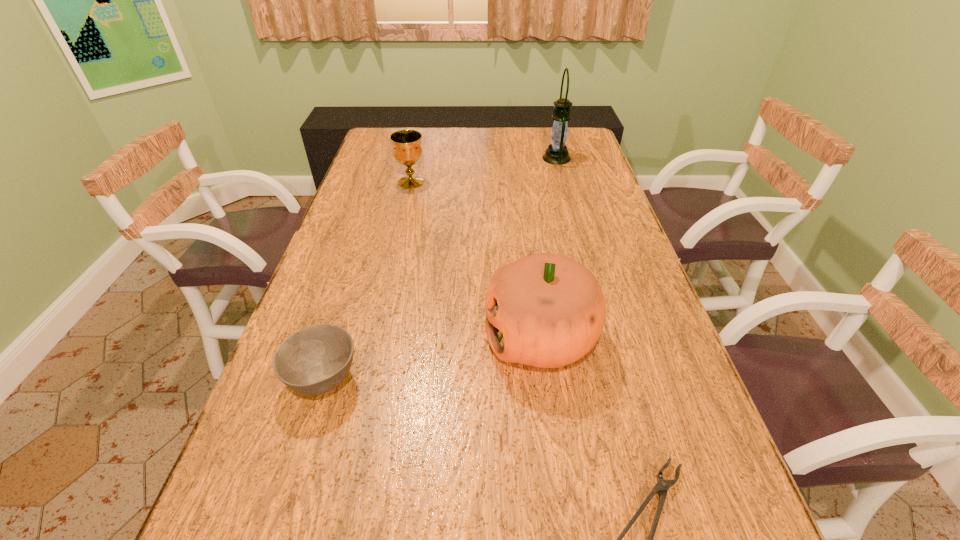
The width and height of the screenshot is (960, 540). Find the location of `vacant region located on the face of the pumpkin`. vacant region located on the face of the pumpkin is located at coordinates (379, 337).

Locate an element on the screen. The height and width of the screenshot is (540, 960). free location located 0.220m on the face of the pumpkin is located at coordinates (388, 337).

At what (x,y) coordinates should I click in order to perform the action: click on free space located on the left of the fourth nearest object. Please return your answer as a coordinate pair (x, y). This screenshot has height=540, width=960. Looking at the image, I should click on (364, 182).

Identify the location of vacant space located 0.210m on the back of the second shortest object. (353, 286).

The height and width of the screenshot is (540, 960). I want to click on object that is at the far edge, so click(556, 153).

I want to click on chalice that is positioned at the left edge, so click(x=407, y=150).

The width and height of the screenshot is (960, 540). I want to click on bowl that is at the left edge, so click(x=312, y=361).

Locate an element on the screen. object present at the right edge is located at coordinates (556, 153).

The height and width of the screenshot is (540, 960). I want to click on object that is at the far right corner, so click(x=556, y=153).

Where is `vacant space at the far edge of the desktop`? Image resolution: width=960 pixels, height=540 pixels. vacant space at the far edge of the desktop is located at coordinates tap(474, 141).